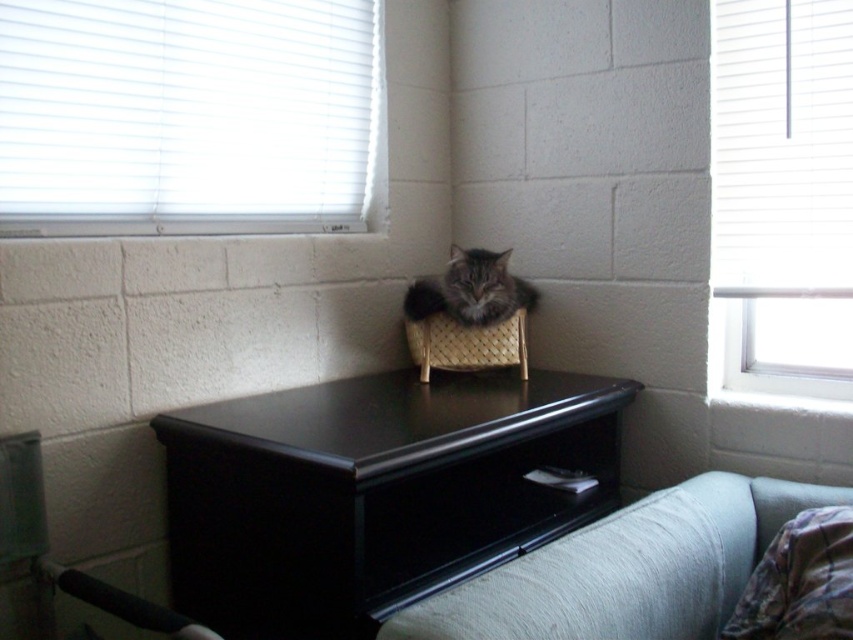
Can you confirm if light gray fabric couch at lower right is positioned below gray tabby cat in woven basket at center?

Yes.

Can you confirm if light gray fabric couch at lower right is thinner than gray tabby cat in woven basket at center?

No, light gray fabric couch at lower right is not thinner than gray tabby cat in woven basket at center.

Is point (416, 632) positioned after point (426, 308)?

No, it is not.

The image size is (853, 640). Find the location of `light gray fabric couch at lower right`. light gray fabric couch at lower right is located at coordinates (627, 568).

Which is behind, point (831, 278) or point (538, 465)?

Positioned behind is point (538, 465).

Is the position of white blinds at upper right more distant than that of black wood drawer at lower center?

Yes, it is.

Does point (807, 300) come closer to viewer compared to point (404, 504)?

No, (807, 300) is further to viewer.

I want to click on white blinds at upper right, so click(782, 193).

From the picture: Does white blinds at upper left have a greater width compared to white blinds at upper right?

Correct, the width of white blinds at upper left exceeds that of white blinds at upper right.

Can you confirm if white blinds at upper left is smaller than white blinds at upper right?

No, white blinds at upper left is not smaller than white blinds at upper right.

Is point (177, 97) behind point (802, 152)?

No.

Locate an element on the screen. white blinds at upper left is located at coordinates (187, 116).